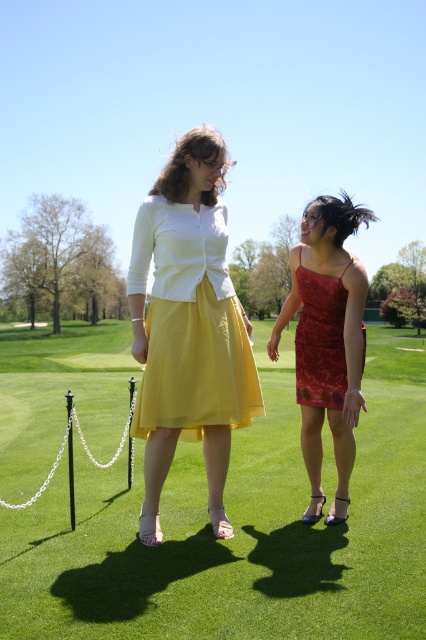
You are a photographer trying to capture a clear shot of both the shiny red dress at center and the matte red dress at center. Which dress will appear larger in the photo?

The shiny red dress at center will appear larger in the photo because it is closer to the viewer than the matte red dress at center.

You are a photographer positioned behind the two women on the golf course. You want to capture a shot where the green grass at center is visible to the right of the yellow chiffon skirt at center. Is this possible given their current positions?

Yes, because the green grass at center is already positioned to the right of the yellow chiffon skirt at center, so the photographer can capture the desired shot.